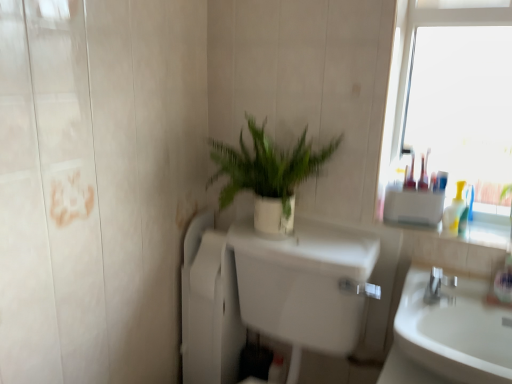
This screenshot has width=512, height=384. What do you see at coordinates (455, 210) in the screenshot? I see `translucent plastic bottles at right` at bounding box center [455, 210].

The image size is (512, 384). Describe the element at coordinates (448, 336) in the screenshot. I see `white glossy sink at lower right` at that location.

Find the location of a particular element. translucent plastic bottles at right is located at coordinates (455, 210).

From the image's perspective, is white glossy sink at lower right under white glossy toilet at center?

No.

Based on the photo, from their relative heights in the image, would you say white glossy sink at lower right is taller or shorter than white glossy toilet at center?

white glossy sink at lower right is shorter than white glossy toilet at center.

In the scene shown: Is white glossy sink at lower right smaller than white glossy toilet at center?

Yes.

Where is `sink above the white glossy toilet at center (from a real-world perspective)`? This screenshot has width=512, height=384. sink above the white glossy toilet at center (from a real-world perspective) is located at coordinates (448, 336).

Would you consider white glossy toilet at center to be distant from silver metallic faucet at right?

No, white glossy toilet at center is in close proximity to silver metallic faucet at right.

Does point (263, 252) lie in front of point (449, 282)?

No.

In the scene shown: Is white glossy toilet at center to the left of silver metallic faucet at right from the viewer's perspective?

Indeed, white glossy toilet at center is positioned on the left side of silver metallic faucet at right.

Could you tell me if white glossy sink at lower right is turned towards translucent plastic bottles at right?

No, white glossy sink at lower right does not turn towards translucent plastic bottles at right.

Looking at this image, which is in front, white glossy sink at lower right or translucent plastic bottles at right?

white glossy sink at lower right is more forward.

From the image's perspective, is white glossy sink at lower right under translucent plastic bottles at right?

Correct, white glossy sink at lower right appears lower than translucent plastic bottles at right in the image.

Where is `toiletry lying above the white glossy sink at lower right (from the image's perspective)`? toiletry lying above the white glossy sink at lower right (from the image's perspective) is located at coordinates 455,210.

Can you confirm if white glossy toilet at center is taller than white glossy sink at lower right?

Correct, white glossy toilet at center is much taller as white glossy sink at lower right.

How much distance is there between white glossy toilet at center and white glossy sink at lower right?

white glossy toilet at center and white glossy sink at lower right are 35.55 centimeters apart.

Can you confirm if white glossy toilet at center is thinner than white glossy sink at lower right?

In fact, white glossy toilet at center might be wider than white glossy sink at lower right.

Does white glossy toilet at center contain white glossy sink at lower right?

No, white glossy toilet at center does not contain white glossy sink at lower right.

From a real-world perspective, is white matte plant pot at center on top of white glossy toilet at center?

Yes, from a real-world perspective, white matte plant pot at center is on top of white glossy toilet at center.

Does white matte plant pot at center have a larger size compared to white glossy toilet at center?

Incorrect, white matte plant pot at center is not larger than white glossy toilet at center.

In the scene shown: Is white matte plant pot at center wider than white glossy toilet at center?

No, white matte plant pot at center is not wider than white glossy toilet at center.

Does white matte plant pot at center come behind white glossy toilet at center?

Yes, the depth of white matte plant pot at center is greater than that of white glossy toilet at center.

Does point (441, 273) come farther from viewer compared to point (446, 210)?

That is False.

Is translucent plastic bottles at right at the back of silver metallic faucet at right?

No.

Considering the relative sizes of silver metallic faucet at right and translucent plastic bottles at right in the image provided, is silver metallic faucet at right shorter than translucent plastic bottles at right?

Yes, silver metallic faucet at right is shorter than translucent plastic bottles at right.

Is translucent plastic bottles at right located within silver metallic faucet at right?

No, silver metallic faucet at right does not contain translucent plastic bottles at right.

Is point (453, 203) farther from viewer compared to point (329, 351)?

That is False.

Locate an element on the screen. The height and width of the screenshot is (384, 512). bath in front of the translucent plastic bottles at right is located at coordinates (267, 293).

Is translucent plastic bottles at right aimed at white glossy toilet at center?

No, translucent plastic bottles at right is not oriented towards white glossy toilet at center.

Identify the location of bath that is in front of the white glossy sink at lower right. The height and width of the screenshot is (384, 512). (267, 293).

Where is `tap above the white glossy toilet at center (from a real-world perspective)`? This screenshot has height=384, width=512. tap above the white glossy toilet at center (from a real-world perspective) is located at coordinates click(438, 285).

Which object lies nearer to the anchor point white glossy sink at lower right, white matte plant pot at center or white glossy toilet at center?

Among the two, white glossy toilet at center is located nearer to white glossy sink at lower right.

When comparing their distances from translucent plastic bottles at right, does white matte plant pot at center or white glossy sink at lower right seem further?

Based on the image, white matte plant pot at center appears to be further to translucent plastic bottles at right.

Based on their spatial positions, is silver metallic faucet at right or white glossy sink at lower right closer to white matte plant pot at center?

white glossy sink at lower right is closer to white matte plant pot at center.

Considering their positions, is translucent plastic bottles at right positioned closer to white glossy sink at lower right than white matte plant pot at center?

The object closer to white glossy sink at lower right is translucent plastic bottles at right.

Considering their positions, is white glossy sink at lower right positioned closer to silver metallic faucet at right than translucent plastic bottles at right?

white glossy sink at lower right.

Which object lies nearer to the anchor point silver metallic faucet at right, white glossy toilet at center or translucent plastic bottles at right?

translucent plastic bottles at right is positioned closer to the anchor silver metallic faucet at right.

Estimate the real-world distances between objects in this image. Which object is further from white glossy sink at lower right, silver metallic faucet at right or translucent plastic bottles at right?

Among the two, translucent plastic bottles at right is located further to white glossy sink at lower right.

Estimate the real-world distances between objects in this image. Which object is further from white matte plant pot at center, white glossy toilet at center or silver metallic faucet at right?

silver metallic faucet at right lies further to white matte plant pot at center than the other object.

You are a GUI agent. You are given a task and a screenshot of the screen. Output one action in this format:
    pyautogui.click(x=<x>, y=<y>)
    Task: Click on the bath between white matte plant pot at center and translucent plastic bottles at right
    
    Given the screenshot: What is the action you would take?
    pyautogui.click(x=267, y=293)

I want to click on tap situated between white matte plant pot at center and white glossy sink at lower right from left to right, so click(438, 285).

Where is `sink between white matte plant pot at center and translucent plastic bottles at right in the horizontal direction`? The image size is (512, 384). sink between white matte plant pot at center and translucent plastic bottles at right in the horizontal direction is located at coordinates (448, 336).

This screenshot has width=512, height=384. Identify the location of tap between white matte plant pot at center and white glossy toilet at center from top to bottom. (438, 285).